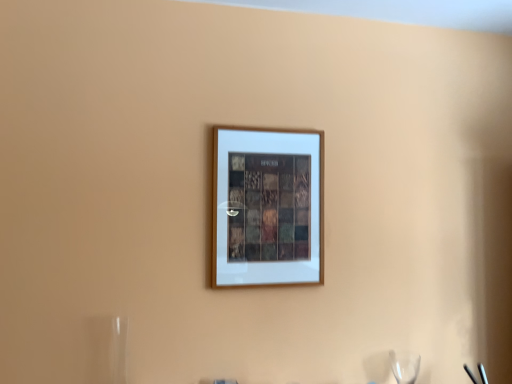
Question: In terms of size, does transparent glass wine glass at lower right appear bigger or smaller than wooden picture frame at center?

Choices:
 (A) big
 (B) small

Answer: (B)

Question: Is transparent glass wine glass at lower right to the left or to the right of wooden picture frame at center in the image?

Choices:
 (A) left
 (B) right

Answer: (B)

Question: From the image's perspective, is transparent glass wine glass at lower right located above or below wooden picture frame at center?

Choices:
 (A) above
 (B) below

Answer: (B)

Question: Is wooden picture frame at center bigger or smaller than transparent glass wine glass at lower right?

Choices:
 (A) small
 (B) big

Answer: (B)

Question: Is wooden picture frame at center to the left or to the right of transparent glass wine glass at lower right in the image?

Choices:
 (A) right
 (B) left

Answer: (B)

Question: Is wooden picture frame at center in front of or behind transparent glass wine glass at lower right in the image?

Choices:
 (A) behind
 (B) front

Answer: (B)

Question: Looking at their shapes, would you say wooden picture frame at center is wider or thinner than transparent glass wine glass at lower right?

Choices:
 (A) wide
 (B) thin

Answer: (B)